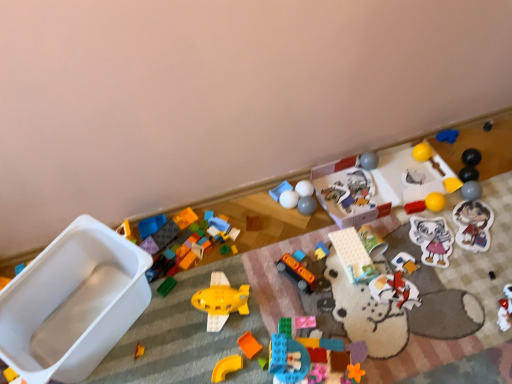
Locate an element on the screen. unoccupied space behind white matte balls at center, the 17th toy viewed from the right is located at coordinates (287, 185).